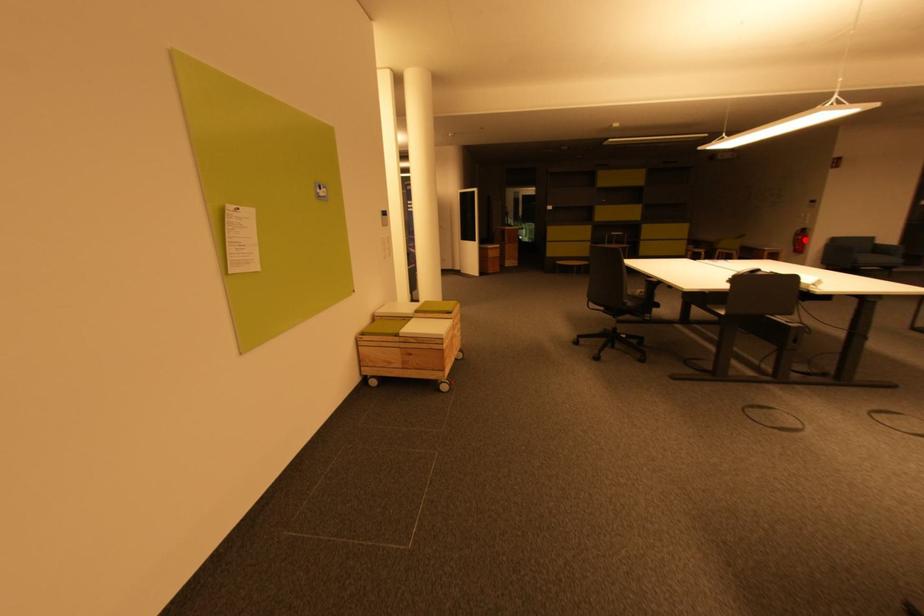
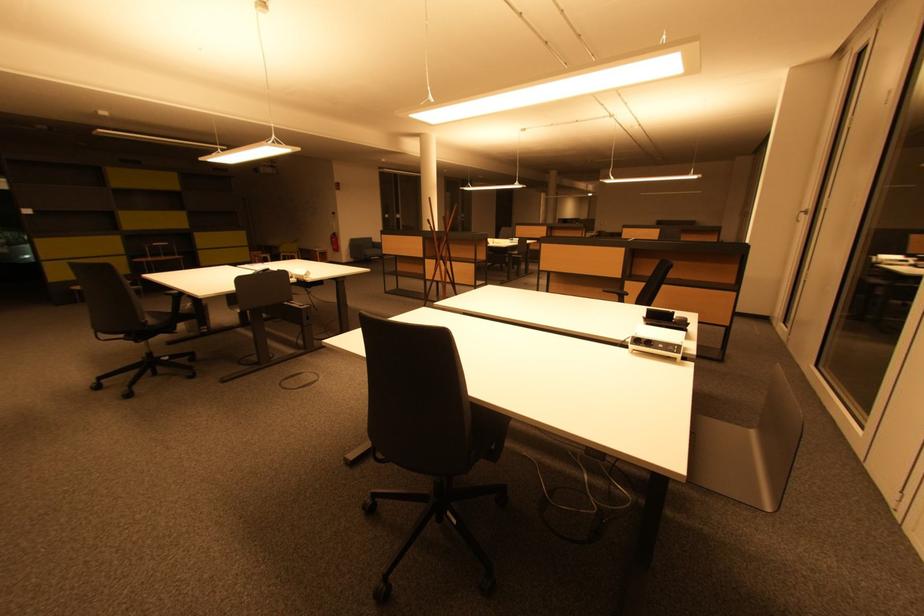
Question: I am providing you with two images of the same scene from different viewpoints. A red point is shown in image1. For the corresponding object point in image2, is it positioned nearer or farther from the camera?

Choices:
 (A) Nearer
 (B) Farther

Answer: (A)